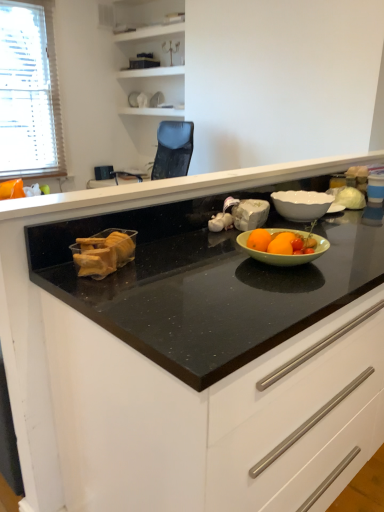
Question: From their relative heights in the image, would you say white blinds at left is taller or shorter than black granite countertop at center?

Choices:
 (A) short
 (B) tall

Answer: (B)

Question: Is point (31, 13) positioned closer to the camera than point (374, 159)?

Choices:
 (A) closer
 (B) farther

Answer: (B)

Question: Estimate the real-world distances between objects in this image. Which object is farther from the white blinds at left?

Choices:
 (A) black granite countertop at center
 (B) translucent plastic baguette at left
 (C) white glossy bowl at upper right
 (D) black granite countertop at center

Answer: (B)

Question: Estimate the real-world distances between objects in this image. Which object is farther from the white blinds at left?

Choices:
 (A) translucent plastic baguette at left
 (B) black granite countertop at center
 (C) white glossy bowl at upper right
 (D) black granite countertop at center

Answer: (A)